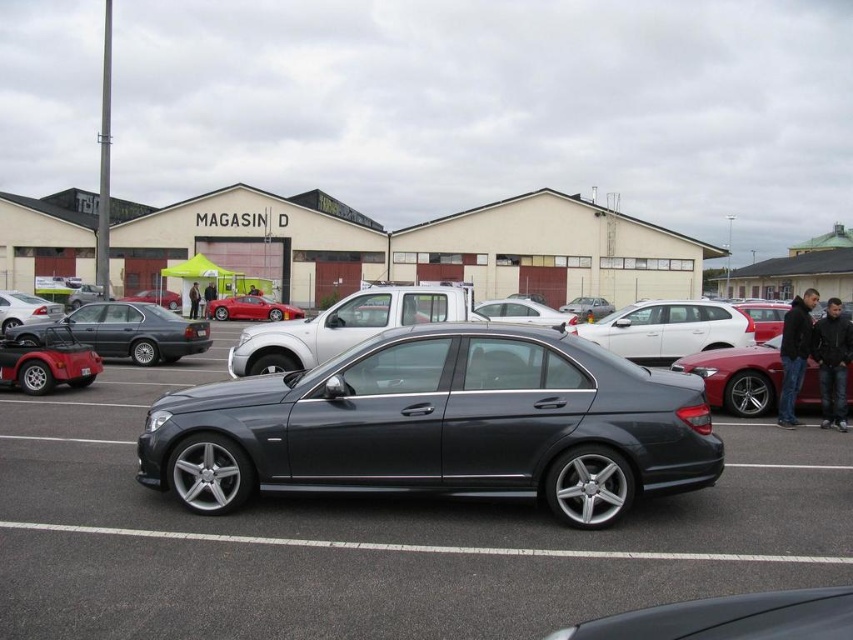
Who is positioned more to the left, satin black car at center or metallic gray sedan at right?

From the viewer's perspective, satin black car at center appears more on the left side.

Based on the photo, does satin black car at center have a larger size compared to metallic gray sedan at right?

Yes.

What are the coordinates of `satin black car at center` in the screenshot? It's located at (376, 538).

What do you see at coordinates (793, 353) in the screenshot?
I see `black leather jacket at right` at bounding box center [793, 353].

Where is `black leather jacket at right`? The width and height of the screenshot is (853, 640). black leather jacket at right is located at coordinates (793, 353).

Can you confirm if satin metallic sedan at center is shorter than white metallic suv at center?

In fact, satin metallic sedan at center may be taller than white metallic suv at center.

What are the coordinates of `satin metallic sedan at center` in the screenshot? It's located at (440, 426).

This screenshot has height=640, width=853. What are the coordinates of `satin metallic sedan at center` in the screenshot? It's located at (440, 426).